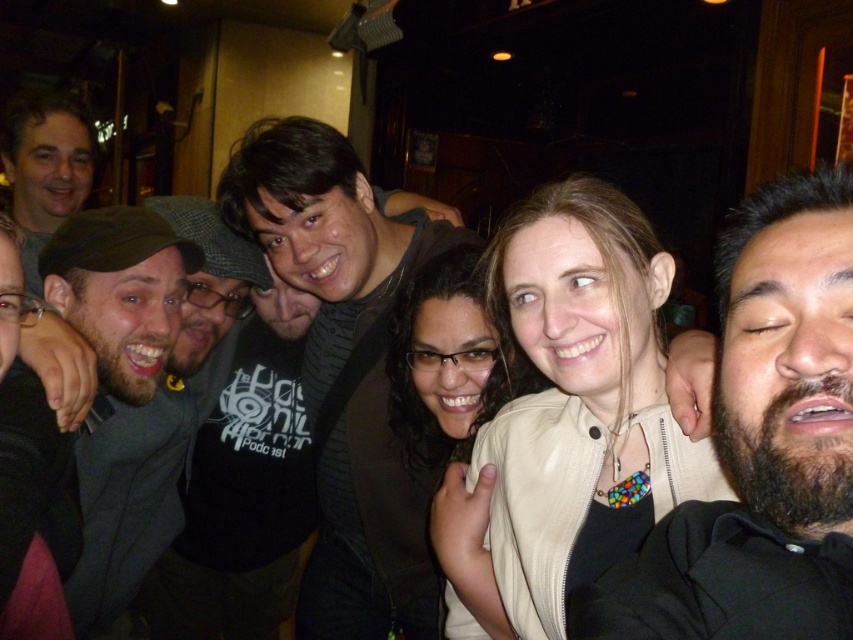
Question: In this image, where is light beige leather jacket at center located relative to dark green fabric shirt at left?

Choices:
 (A) right
 (B) left

Answer: (A)

Question: Among these objects, which one is nearest to the camera?

Choices:
 (A) light beige leather jacket at center
 (B) dark gray sweater at center
 (C) black matte beard at center
 (D) dark green fabric shirt at left

Answer: (C)

Question: Considering the real-world distances, which object is farthest from the dark gray sweater at center?

Choices:
 (A) dark green fabric shirt at left
 (B) light beige leather jacket at center
 (C) black matte beard at center

Answer: (C)

Question: Does black matte beard at center appear over dark green fabric shirt at left?

Choices:
 (A) no
 (B) yes

Answer: (B)

Question: Considering the real-world distances, which object is farthest from the light beige leather jacket at center?

Choices:
 (A) black matte beard at center
 (B) dark gray sweater at center

Answer: (B)

Question: Is light beige leather jacket at center bigger than dark green fabric shirt at left?

Choices:
 (A) no
 (B) yes

Answer: (A)